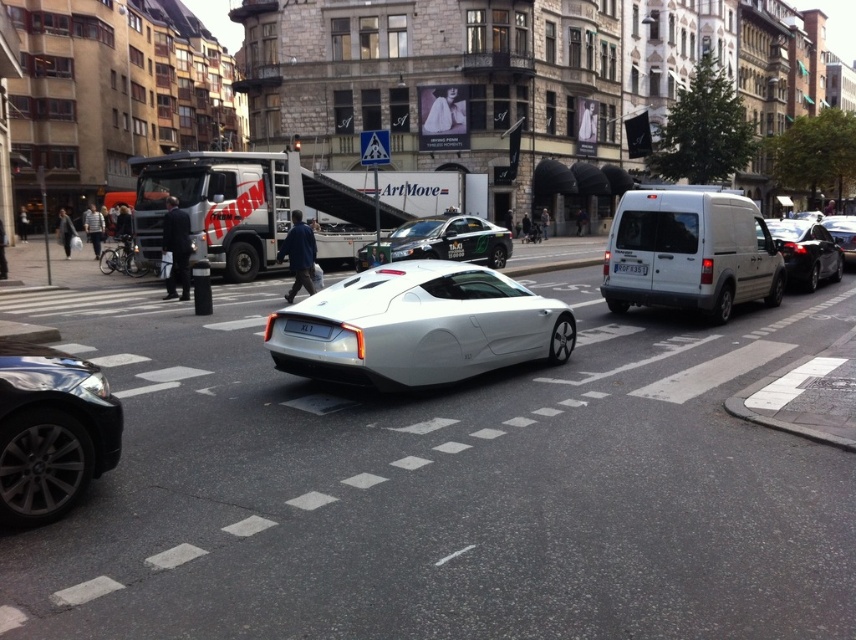
What do you see at coordinates (441, 241) in the screenshot? Image resolution: width=856 pixels, height=640 pixels. I see `metallic silver car at center` at bounding box center [441, 241].

Which is behind, point (476, 237) or point (622, 269)?

The point (476, 237) is more distant.

Find the location of a particular element. metallic silver car at center is located at coordinates (441, 241).

Is white matte van at right wider than metallic silver car at center?

No, white matte van at right is not wider than metallic silver car at center.

Can you confirm if white matte van at right is positioned below metallic silver car at center?

Correct, white matte van at right is located below metallic silver car at center.

Does point (637, 256) come behind point (385, 257)?

No, (637, 256) is closer to viewer.

At what (x,y) coordinates should I click in order to perform the action: click on white matte van at right. Please return your answer as a coordinate pair (x, y). Looking at the image, I should click on (691, 252).

Does metallic silver car at center have a lesser width compared to shiny black car at right?

Indeed, metallic silver car at center has a lesser width compared to shiny black car at right.

Is point (467, 237) more distant than point (801, 264)?

Yes, it is.

Find the location of `metallic silver car at center`. metallic silver car at center is located at coordinates (441, 241).

You are a GUI agent. You are given a task and a screenshot of the screen. Output one action in this format:
    pyautogui.click(x=<x>, y=<y>)
    Task: Click on the metallic silver car at center
    The image size is (856, 640).
    Given the screenshot: What is the action you would take?
    pyautogui.click(x=441, y=241)